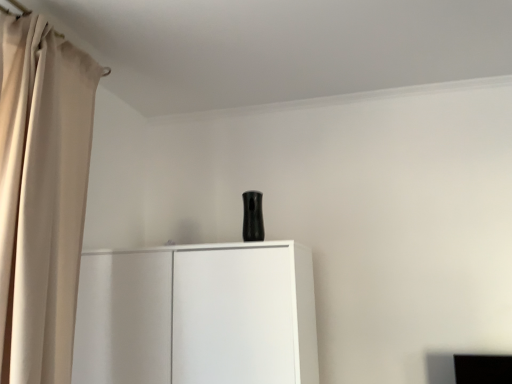
Measure the distance between point (172, 369) and camera.

Point (172, 369) and camera are 1.49 meters apart from each other.

What is the approximate height of white matte cupboard at center?

white matte cupboard at center is 66.58 centimeters tall.

Find the location of a particular element. Image resolution: width=512 pixels, height=384 pixels. white matte cupboard at center is located at coordinates (197, 315).

What do you see at coordinates (197, 315) in the screenshot?
I see `white matte cupboard at center` at bounding box center [197, 315].

The image size is (512, 384). Identify the location of beige fabric curtain at left. (41, 196).

What do you see at coordinates (41, 196) in the screenshot? I see `beige fabric curtain at left` at bounding box center [41, 196].

Identify the location of white matte cupboard at center. The height and width of the screenshot is (384, 512). (197, 315).

Based on the photo, which is more to the right, white matte cupboard at center or beige fabric curtain at left?

white matte cupboard at center.

Who is more distant, white matte cupboard at center or beige fabric curtain at left?

white matte cupboard at center is behind.

Is point (296, 294) more distant than point (5, 234)?

Yes, it is.

From the image's perspective, is white matte cupboard at center below beige fabric curtain at left?

Yes, from the image's perspective, white matte cupboard at center is beneath beige fabric curtain at left.

From a real-world perspective, is white matte cupboard at center physically below beige fabric curtain at left?

Yes, from a real-world perspective, white matte cupboard at center is beneath beige fabric curtain at left.

Which of these two, white matte cupboard at center or beige fabric curtain at left, is wider?

Result: With larger width is white matte cupboard at center.

Considering the relative sizes of white matte cupboard at center and beige fabric curtain at left in the image provided, is white matte cupboard at center shorter than beige fabric curtain at left?

Correct, white matte cupboard at center is not as tall as beige fabric curtain at left.

Who is bigger, white matte cupboard at center or beige fabric curtain at left?

white matte cupboard at center.

Is beige fabric curtain at left a part of white matte cupboard at center?

That's incorrect, beige fabric curtain at left is not inside white matte cupboard at center.

Is white matte cupboard at center far from beige fabric curtain at left?

No.

Could you tell me if white matte cupboard at center is turned towards beige fabric curtain at left?

No, white matte cupboard at center is not aimed at beige fabric curtain at left.

What's the angular difference between white matte cupboard at center and beige fabric curtain at left's facing directions?

The angle between the facing direction of white matte cupboard at center and the facing direction of beige fabric curtain at left is 90 degrees.

You are a GUI agent. You are given a task and a screenshot of the screen. Output one action in this format:
    pyautogui.click(x=<x>, y=<y>)
    Task: Click on the cupboard on the right side of beige fabric curtain at left
    
    Given the screenshot: What is the action you would take?
    pyautogui.click(x=197, y=315)

Which is more to the right, beige fabric curtain at left or white matte cupboard at center?

white matte cupboard at center.

Based on the photo, relative to white matte cupboard at center, is beige fabric curtain at left in front or behind?

Visually, beige fabric curtain at left is located in front of white matte cupboard at center.

Is point (37, 47) positioned before point (274, 273)?

Yes, it is.

From the image's perspective, would you say beige fabric curtain at left is shown under white matte cupboard at center?

No.

From a real-world perspective, who is located higher, beige fabric curtain at left or white matte cupboard at center?

beige fabric curtain at left, from a real-world perspective.

From the picture: Considering the sizes of objects beige fabric curtain at left and white matte cupboard at center in the image provided, who is wider, beige fabric curtain at left or white matte cupboard at center?

Wider between the two is white matte cupboard at center.

Consider the image. Considering the sizes of objects beige fabric curtain at left and white matte cupboard at center in the image provided, who is taller, beige fabric curtain at left or white matte cupboard at center?

Standing taller between the two is beige fabric curtain at left.

Considering the sizes of objects beige fabric curtain at left and white matte cupboard at center in the image provided, who is bigger, beige fabric curtain at left or white matte cupboard at center?

white matte cupboard at center is bigger.

Is beige fabric curtain at left positioned beyond the bounds of white matte cupboard at center?

Indeed, beige fabric curtain at left is completely outside white matte cupboard at center.

Is beige fabric curtain at left touching white matte cupboard at center?

No, beige fabric curtain at left is not with white matte cupboard at center.

Is beige fabric curtain at left oriented towards white matte cupboard at center?

No, beige fabric curtain at left is not aimed at white matte cupboard at center.

Based on the photo, what's the angular difference between beige fabric curtain at left and white matte cupboard at center's facing directions?

They differ by 90 degrees in their facing directions.

You are a GUI agent. You are given a task and a screenshot of the screen. Output one action in this format:
    pyautogui.click(x=<x>, y=<y>)
    Task: Click on the curtain that appears in front of the white matte cupboard at center
    The height and width of the screenshot is (384, 512).
    Given the screenshot: What is the action you would take?
    pyautogui.click(x=41, y=196)

Identify the location of curtain that appears above the white matte cupboard at center (from the image's perspective). (41, 196).

Where is `cupboard lying behind the beige fabric curtain at left`? The height and width of the screenshot is (384, 512). cupboard lying behind the beige fabric curtain at left is located at coordinates (197, 315).